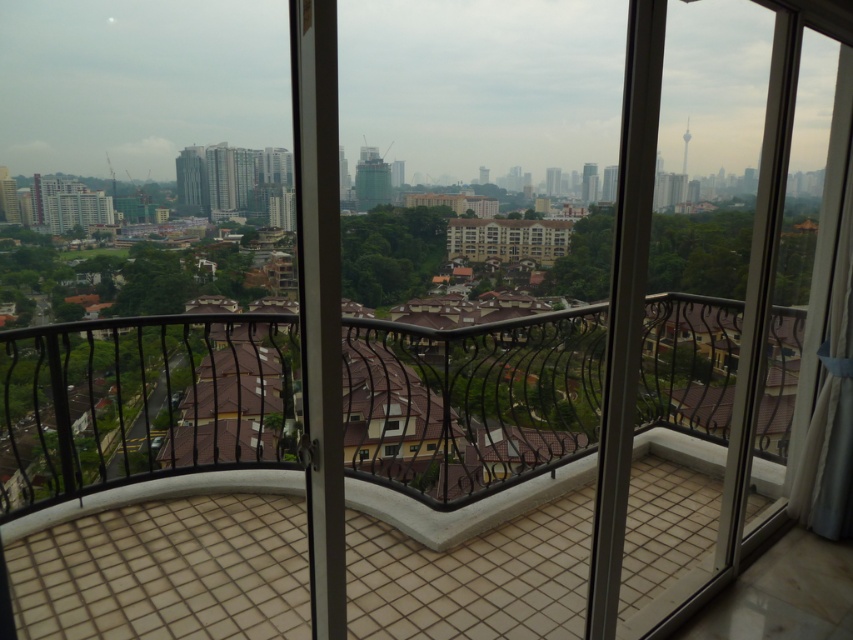
From the picture: You are standing on the balcony looking out at the city. There is a point marked at coordinates (140, 403). What object is located at that point?

The point at coordinates (140, 403) corresponds to the brown tile balcony at center.

You are standing on the brown tile balcony at center. Looking out, you notice a construction crane in the distance. If you want to take a photo of the crane, which direction should you face relative to the balcony?

The brown tile balcony at center is located at point (140, 403). Since the crane is part of the urban skyline further back, you should face towards the urban skyline direction to capture the crane in your photo.